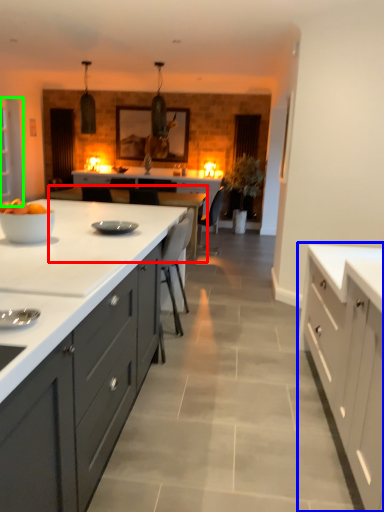
Question: Which object is the closest to the table (highlighted by a red box)? Choose among these: cabinetry (highlighted by a blue box) or glass door (highlighted by a green box).

Choices:
 (A) cabinetry
 (B) glass door

Answer: (B)